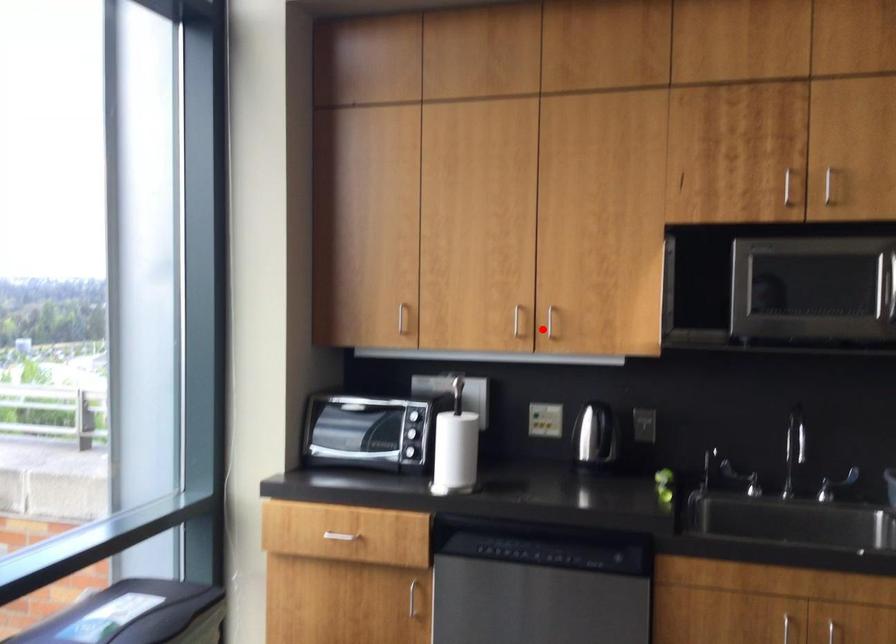
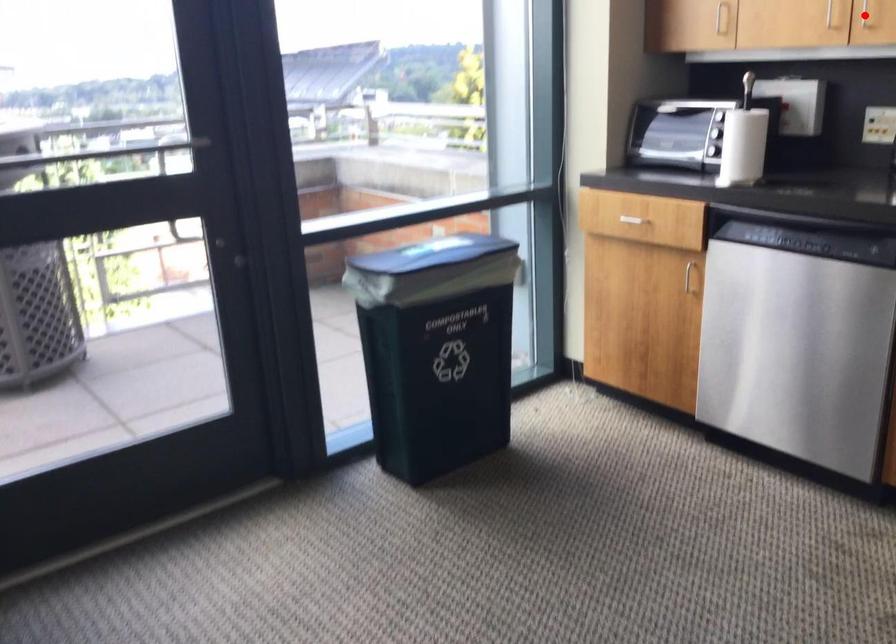
I am providing you with two images of the same scene from different viewpoints. A red point is marked on the first image and another point is marked on the second image. Is the red point in image1 aligned with the point shown in image2?

Yes